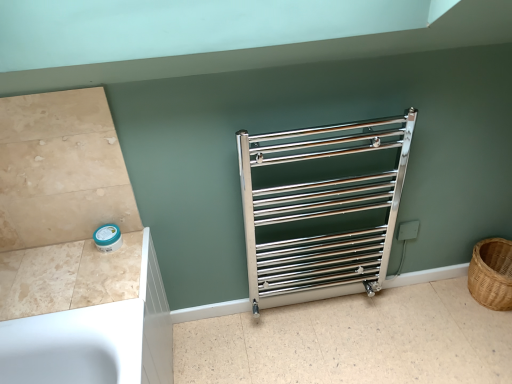
Question: From a real-world perspective, is beige marble counter top at lower left over metallic silver towel rack at center?

Choices:
 (A) yes
 (B) no

Answer: (A)

Question: Can you confirm if beige marble counter top at lower left is taller than metallic silver towel rack at center?

Choices:
 (A) yes
 (B) no

Answer: (B)

Question: Is beige marble counter top at lower left thinner than metallic silver towel rack at center?

Choices:
 (A) no
 (B) yes

Answer: (B)

Question: From a real-world perspective, is beige marble counter top at lower left beneath metallic silver towel rack at center?

Choices:
 (A) yes
 (B) no

Answer: (B)

Question: Considering the relative sizes of beige marble counter top at lower left and metallic silver towel rack at center in the image provided, is beige marble counter top at lower left smaller than metallic silver towel rack at center?

Choices:
 (A) no
 (B) yes

Answer: (B)

Question: Can metallic silver towel rack at center be found inside beige marble counter top at lower left?

Choices:
 (A) no
 (B) yes

Answer: (A)

Question: Does beige marble counter top at lower left have a lesser height compared to brown woven basket at right?

Choices:
 (A) no
 (B) yes

Answer: (B)

Question: Is beige marble counter top at lower left thinner than brown woven basket at right?

Choices:
 (A) yes
 (B) no

Answer: (B)

Question: Considering the relative positions of beige marble counter top at lower left and brown woven basket at right in the image provided, is beige marble counter top at lower left to the left of brown woven basket at right from the viewer's perspective?

Choices:
 (A) no
 (B) yes

Answer: (B)

Question: Is beige marble counter top at lower left positioned behind brown woven basket at right?

Choices:
 (A) no
 (B) yes

Answer: (A)

Question: Is beige marble counter top at lower left positioned far away from brown woven basket at right?

Choices:
 (A) no
 (B) yes

Answer: (B)

Question: From the image's perspective, is beige marble counter top at lower left on top of brown woven basket at right?

Choices:
 (A) yes
 (B) no

Answer: (A)

Question: Is polished chrome towel rack at center smaller than brown woven basket at right?

Choices:
 (A) no
 (B) yes

Answer: (A)